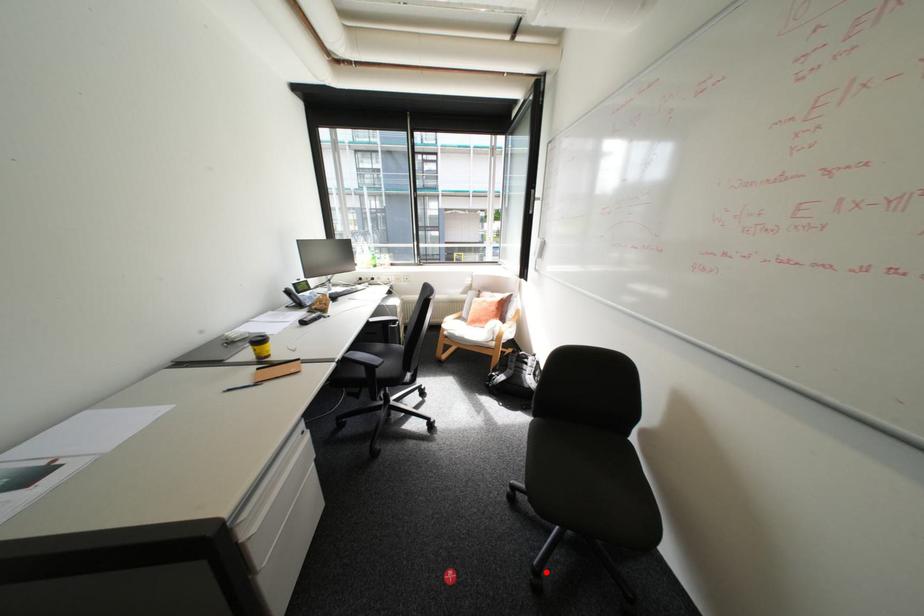
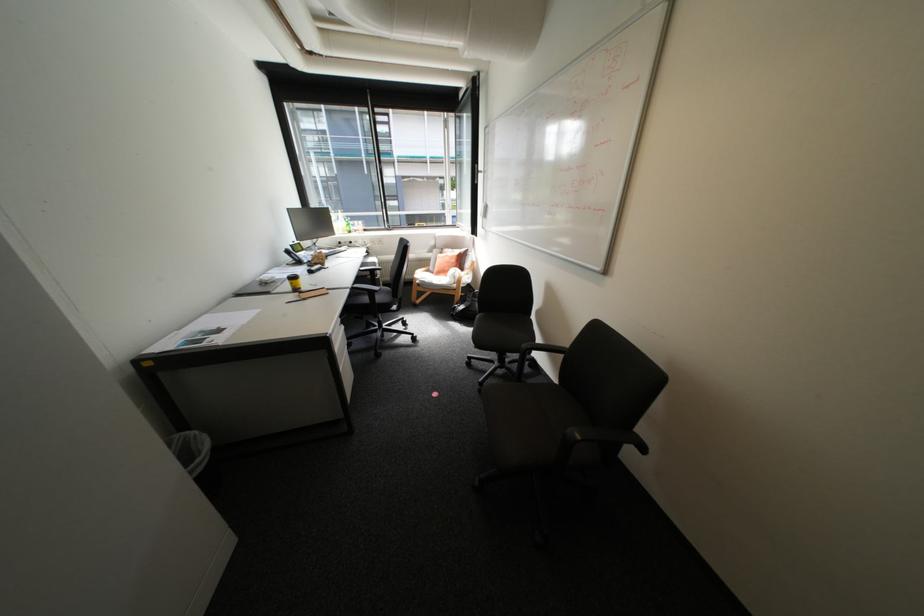
Find the pixel in the second image that matches the highlighted location in the first image.

(491, 384)